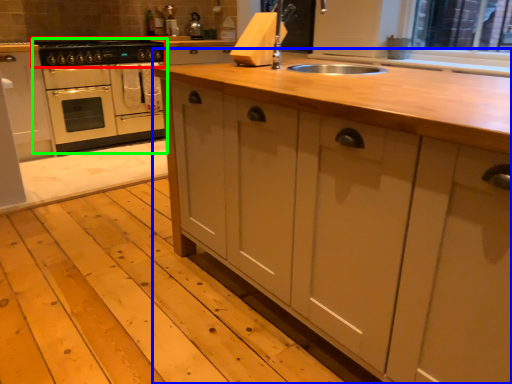
Question: Considering the real-world distances, which object is closest to gas stove (highlighted by a red box)? countertop (highlighted by a blue box) or home appliance (highlighted by a green box).

Choices:
 (A) countertop
 (B) home appliance

Answer: (B)